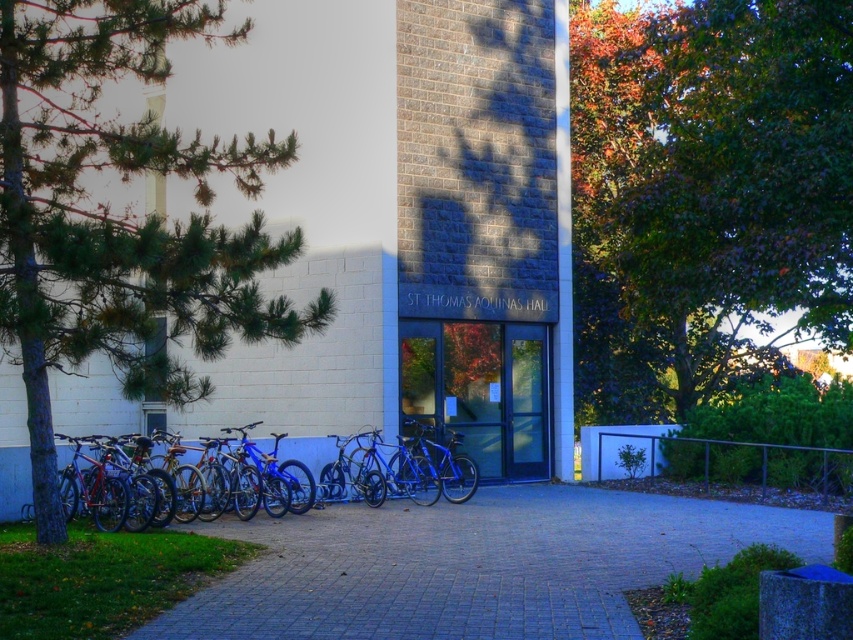
You are standing at the entrance of St. Thomas Aquinas Hall and want to walk to the gray concrete pavement at center. What direction should you move in?

The gray concrete pavement at center is located at point [474,564], so you should move forward towards the center of the image to reach it.